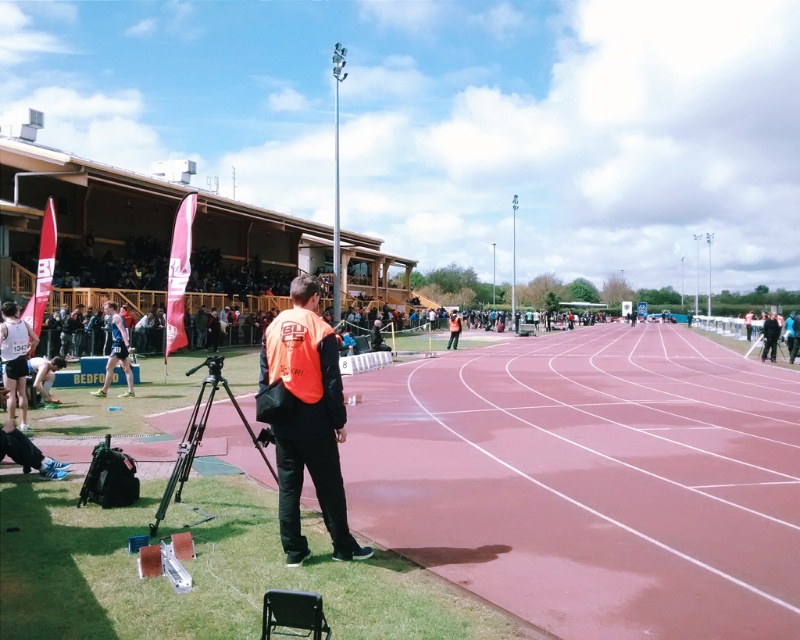
Question: Can you confirm if orange fabric jacket at center is bigger than black matte tripod at lower left?

Choices:
 (A) yes
 (B) no

Answer: (B)

Question: Which point is closer to the camera?

Choices:
 (A) orange reflective vest at center
 (B) white athletic shorts at left

Answer: (B)

Question: Which object appears closest to the camera in this image?

Choices:
 (A) orange fabric jacket at center
 (B) orange reflective vest at center
 (C) white athletic shorts at left

Answer: (A)

Question: Estimate the real-world distances between objects in this image. Which object is closer to the orange reflective vest at center?

Choices:
 (A) orange fabric jacket at center
 (B) black athletic suit at left
 (C) black matte tripod at lower left

Answer: (C)

Question: Is black matte tripod at lower left behind black athletic suit at left?

Choices:
 (A) yes
 (B) no

Answer: (B)

Question: Is white athletic shorts at left in front of black athletic suit at left?

Choices:
 (A) no
 (B) yes

Answer: (B)